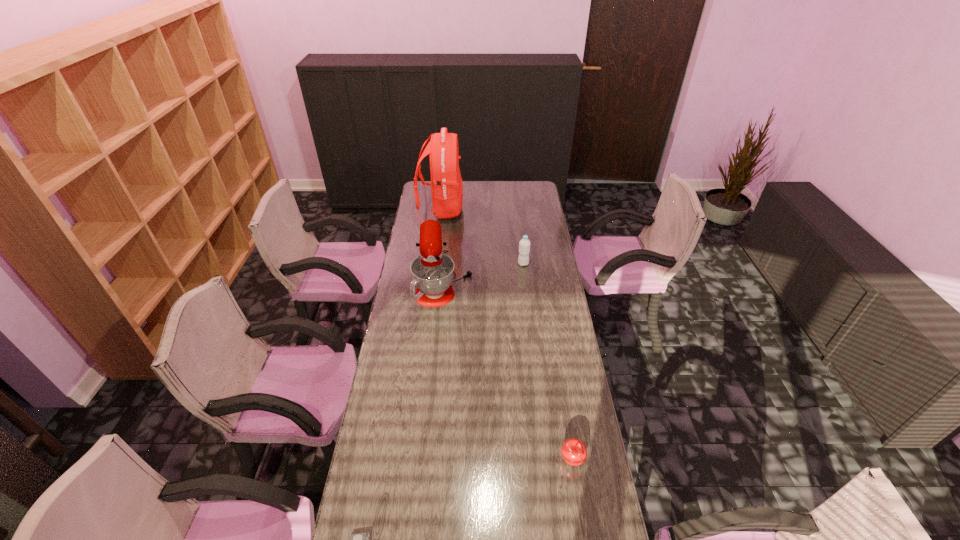
Image resolution: width=960 pixels, height=540 pixels. Identify the location of vacant point that satisfies the following two spatial constraints: 1. on the main compartment of the third shortest object; 2. on the right side of the backpack. (435, 264).

I want to click on vacant space that satisfies the following two spatial constraints: 1. on the bowl side of the mixer; 2. on the left side of the fourth farthest object, so click(x=427, y=461).

This screenshot has width=960, height=540. In order to click on vacant area in the image that satisfies the following two spatial constraints: 1. on the bowl side of the mixer; 2. on the right side of the cherry in this screenshot , I will do `click(427, 461)`.

You are a GUI agent. You are given a task and a screenshot of the screen. Output one action in this format:
    pyautogui.click(x=<x>, y=<y>)
    Task: Click on the vacant area in the image that satisfies the following two spatial constraints: 1. on the main compartment of the fourth farthest object; 2. on the right side of the backpack
    The width and height of the screenshot is (960, 540).
    Given the screenshot: What is the action you would take?
    pyautogui.click(x=411, y=461)

Identify the location of vacant point that satisfies the following two spatial constraints: 1. on the main compartment of the second object from right to left; 2. on the left side of the tallest object. This screenshot has height=540, width=960. (435, 264).

The height and width of the screenshot is (540, 960). What are the coordinates of `free space in the image that satisfies the following two spatial constraints: 1. on the main compartment of the tallest object; 2. on the back side of the second shortest object` in the screenshot? It's located at (411, 461).

At what (x,y) coordinates should I click in order to perform the action: click on vacant region that satisfies the following two spatial constraints: 1. on the main compartment of the water bottle; 2. on the right side of the backpack. Please return your answer as a coordinate pair (x, y). The image size is (960, 540). Looking at the image, I should click on (435, 264).